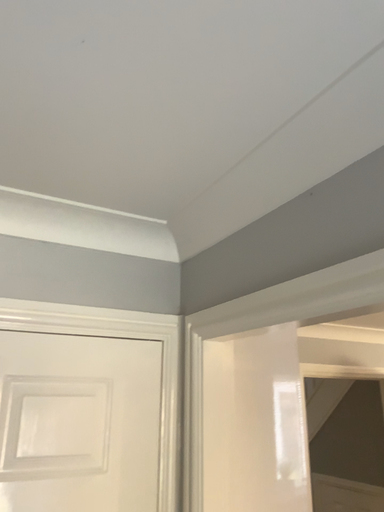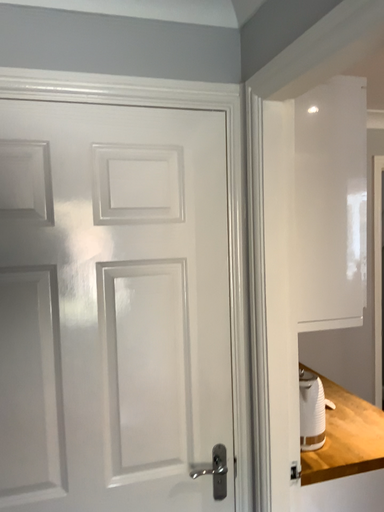
Question: Which way did the camera rotate in the video?

Choices:
 (A) rotated upward
 (B) rotated downward

Answer: (B)